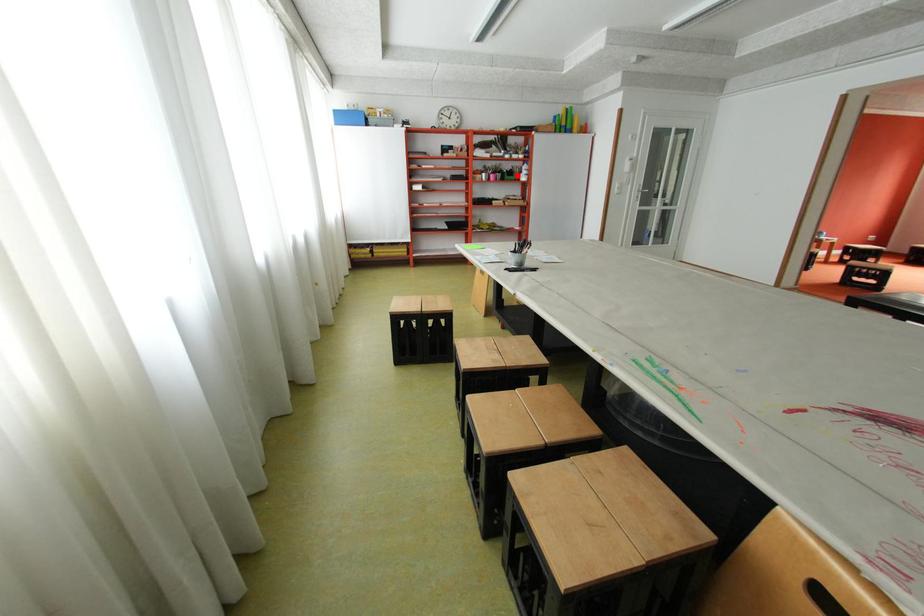
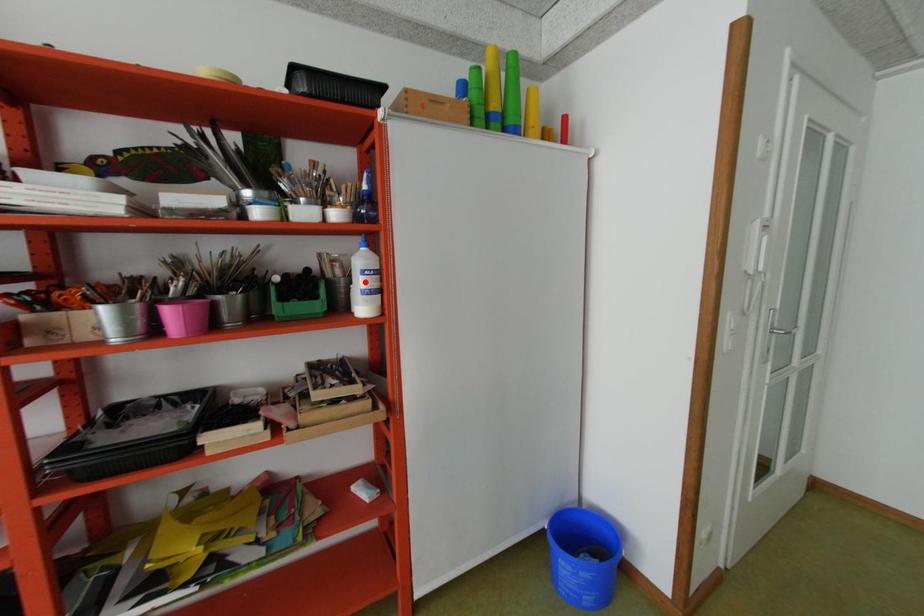
I am providing you with two images of the same scene from different viewpoints. A red point is marked on the first image and another point is marked on the second image. Is the red point in image1 aligned with the point shown in image2?

No